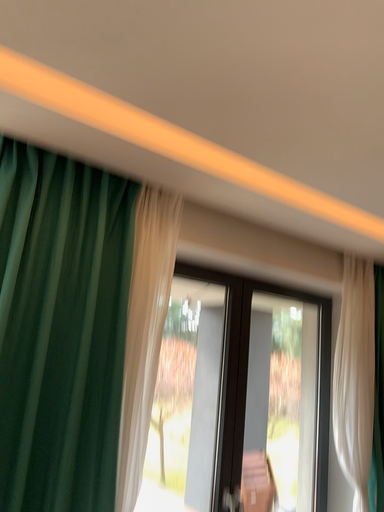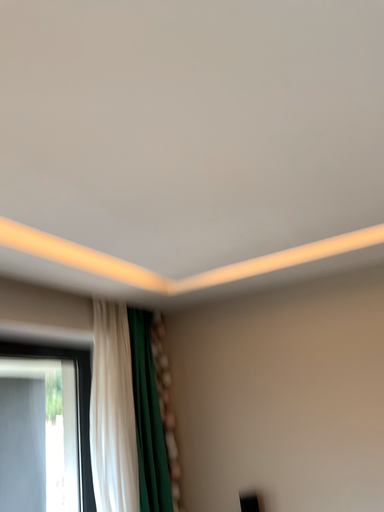
Question: How did the camera likely rotate when shooting the video?

Choices:
 (A) rotated downward
 (B) rotated upward

Answer: (B)